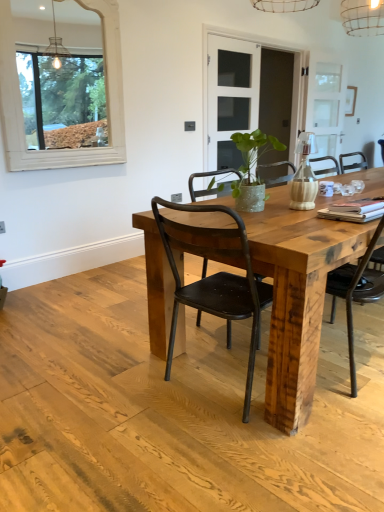
Question: Based on their positions, is matte white vase at center located to the left or right of white wooden frame at upper left?

Choices:
 (A) right
 (B) left

Answer: (A)

Question: From the image's perspective, is matte white vase at center positioned above or below white wooden frame at upper left?

Choices:
 (A) below
 (B) above

Answer: (A)

Question: Which object is positioned closest to the green textured vase at center?

Choices:
 (A) white wooden frame at upper left
 (B) clear glass door at center
 (C) reclaimed wood table at center
 (D) matte white vase at center

Answer: (D)

Question: Considering the real-world distances, which object is farthest from the reclaimed wood table at center?

Choices:
 (A) green textured vase at center
 (B) white wooden frame at upper left
 (C) clear glass door at center
 (D) matte white vase at center

Answer: (C)